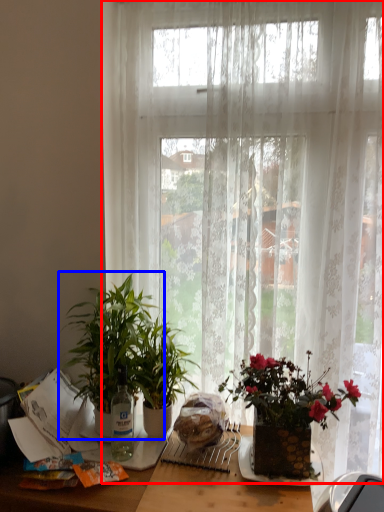
Question: Which of the following is the closest to the observer, curtain (highlighted by a red box) or houseplant (highlighted by a blue box)?

Choices:
 (A) curtain
 (B) houseplant

Answer: (B)